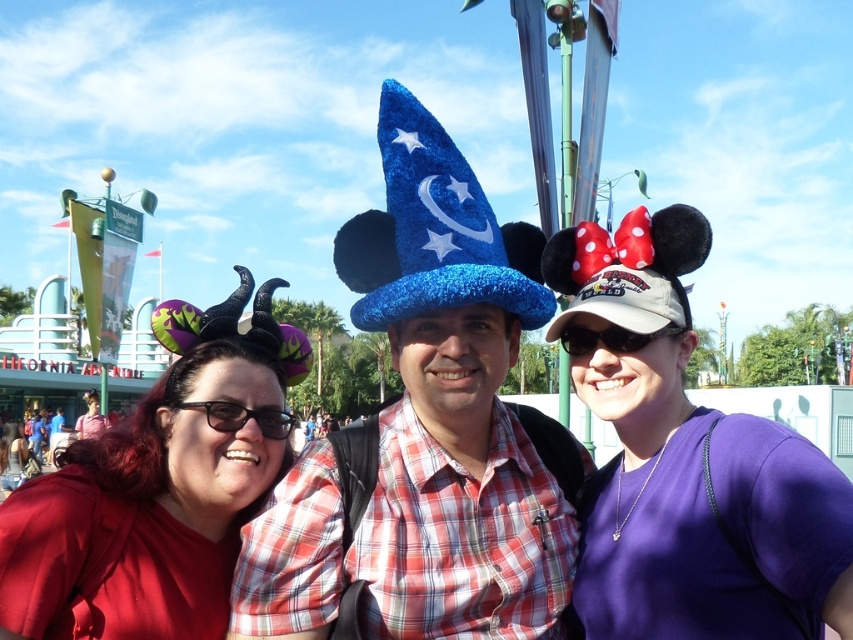
You are a photographer at the theme park and need to ensure that all accessories are visible in the photo. Given that the shiny blue wizard hat at center and the black plastic sunglasses at center are both important, which accessory should you focus on to ensure it doesn not get cropped out due to its size?

The shiny blue wizard hat at center is larger in size compared to the black plastic sunglasses at center, so you should focus on ensuring the hat is fully visible to avoid cropping.

You are a photographer at the theme park. You need to ensure that all props are visible in the photo. Given that the purple fabric minnie mouse hat at right and the matte red shirt at center are part of the subjects, which prop is taller and might block the view of the other?

The purple fabric minnie mouse hat at right is much taller than the matte red shirt at center, so it might block the view of the matte red shirt at center.

You are standing at the center of the image and want to locate the shiny blue wizard hat at center. According to the coordinates provided, in which direction should you look to find it?

The shiny blue wizard hat at center is located at coordinates point (425, 428), which means it is positioned to the right and slightly below the center of the image. Since you are at the center, you should look to your right and slightly downward to locate it.